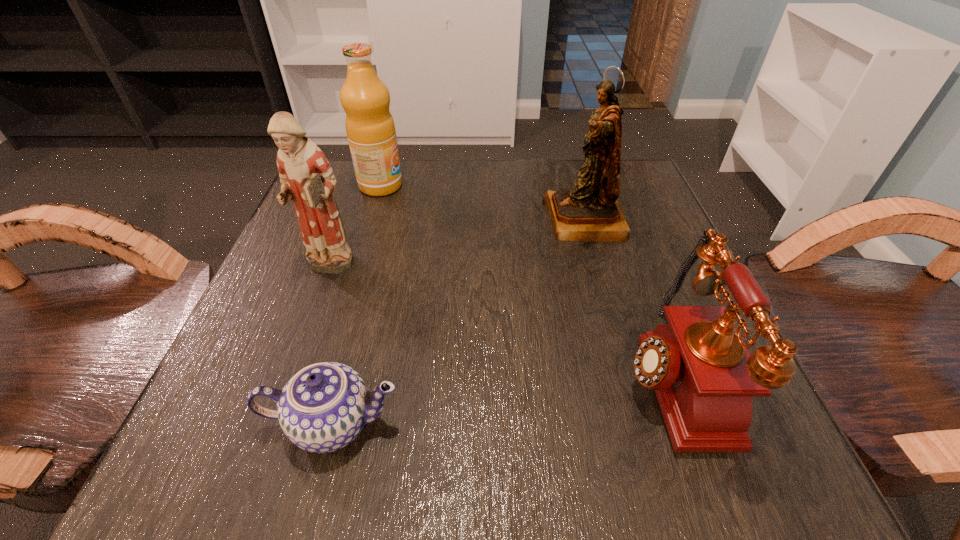
Locate an element on the screen. vacant space at the right edge is located at coordinates (662, 225).

This screenshot has height=540, width=960. Identify the location of vacant area at the far left corner of the desktop. (329, 160).

In the image, there is a desktop. Where is `vacant space at the near left corner`? vacant space at the near left corner is located at coordinates (186, 474).

Locate an element on the screen. Image resolution: width=960 pixels, height=540 pixels. free space at the far right corner is located at coordinates (633, 184).

Where is `vacant space in between the fruit juice and the telephone`? Image resolution: width=960 pixels, height=540 pixels. vacant space in between the fruit juice and the telephone is located at coordinates (524, 281).

Locate an element on the screen. The height and width of the screenshot is (540, 960). free space between the third farthest object and the right figurine is located at coordinates (456, 245).

Where is `vacant space that's between the fruit juice and the right figurine`? The width and height of the screenshot is (960, 540). vacant space that's between the fruit juice and the right figurine is located at coordinates (483, 203).

The image size is (960, 540). I want to click on vacant area that lies between the telephone and the fruit juice, so click(524, 281).

Where is `vacant area that lies between the telephone and the farther figurine`? vacant area that lies between the telephone and the farther figurine is located at coordinates (x=626, y=299).

Find the location of a particular element. This screenshot has width=960, height=540. free space between the third nearest object and the shortest object is located at coordinates (331, 346).